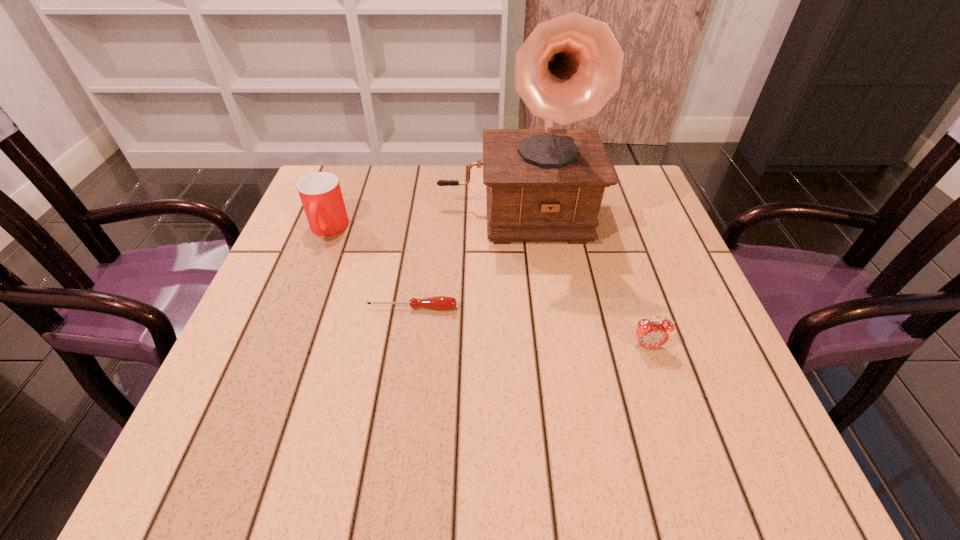
The image size is (960, 540). In order to click on blank space located on the back of the screwdriver in this screenshot , I will do [x=420, y=252].

Locate an element on the screen. The image size is (960, 540). record player that is at the far edge is located at coordinates (543, 185).

Locate an element on the screen. The image size is (960, 540). cup that is positioned at the far edge is located at coordinates (320, 193).

Locate an element on the screen. The image size is (960, 540). object located at the left edge is located at coordinates (320, 193).

Where is `object that is at the right edge`? The height and width of the screenshot is (540, 960). object that is at the right edge is located at coordinates (649, 334).

The width and height of the screenshot is (960, 540). What are the coordinates of `object that is at the far left corner` in the screenshot? It's located at (320, 193).

Find the location of a particular element. Image resolution: width=960 pixels, height=540 pixels. free space at the far edge of the desktop is located at coordinates (468, 198).

Find the location of a particular element. blank space at the near edge of the desktop is located at coordinates (555, 472).

The image size is (960, 540). In the image, there is a desktop. What are the coordinates of `vacant region at the left edge` in the screenshot? It's located at (323, 275).

This screenshot has height=540, width=960. What are the coordinates of `free space at the right edge` in the screenshot? It's located at (660, 256).